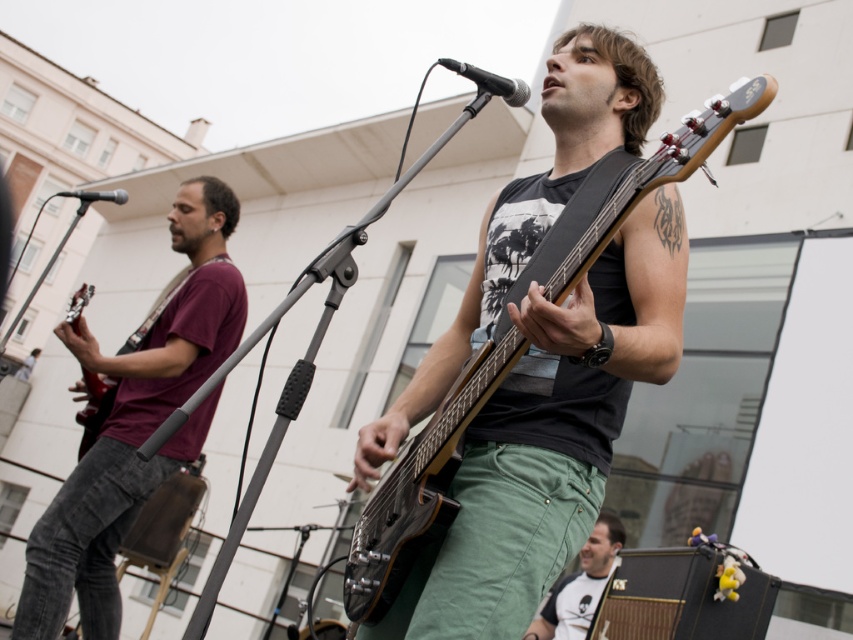
Question: Considering the relative positions of matte black guitar at center and white t-shirt at lower right in the image provided, where is matte black guitar at center located with respect to white t-shirt at lower right?

Choices:
 (A) below
 (B) above

Answer: (B)

Question: From the image, what is the correct spatial relationship of matte black guitar at center in relation to white t-shirt at lower right?

Choices:
 (A) below
 (B) above

Answer: (B)

Question: From the image, what is the correct spatial relationship of maroon cotton shirt at left in relation to matte black guitar at center?

Choices:
 (A) above
 (B) below

Answer: (B)

Question: Which point is farther from the camera taking this photo?

Choices:
 (A) (109, 528)
 (B) (566, 589)

Answer: (B)

Question: Which object is farther from the camera taking this photo?

Choices:
 (A) white t-shirt at lower right
 (B) matte black guitar at center
 (C) maroon cotton shirt at left

Answer: (A)

Question: Which of the following is the closest to the observer?

Choices:
 (A) (601, 541)
 (B) (221, 214)
 (C) (584, 196)

Answer: (C)